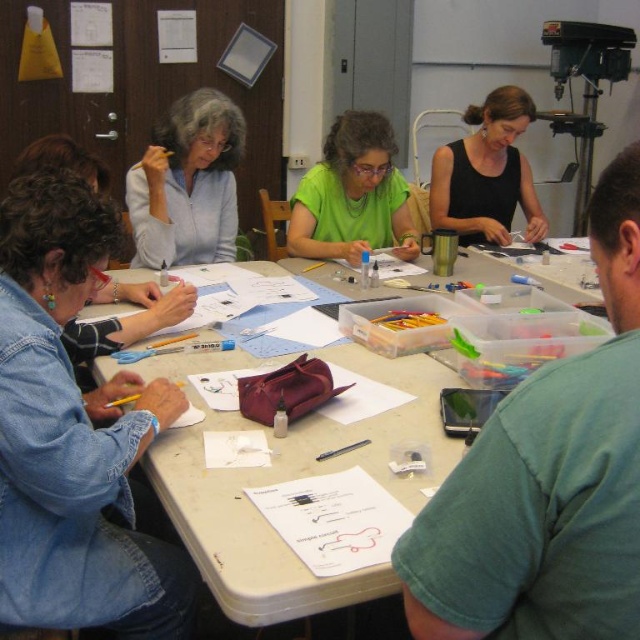
You are a participant in the workshop and need to locate your materials. You remember placing your matte gray jacket at upper left near your supplies. The black matte phone at upper center is where relative to your jacket?

The black matte phone at upper center is to the right of the matte gray jacket at upper left.